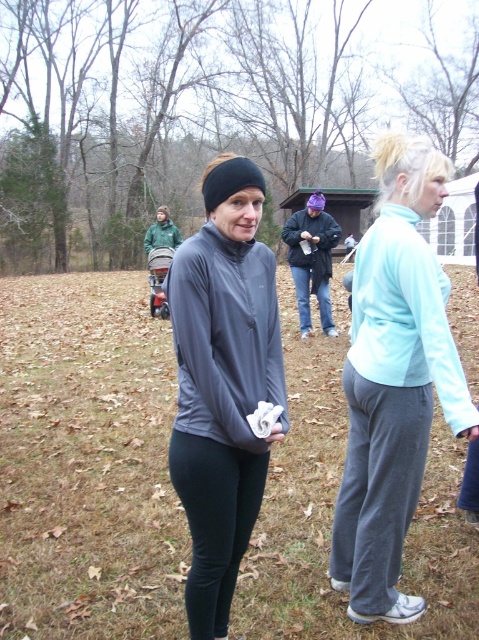
Who is positioned more to the right, light blue fleece at right or matte gray sweatshirt at center?

From the viewer's perspective, light blue fleece at right appears more on the right side.

Is point (431, 394) positioned after point (235, 422)?

Yes.

Who is more forward, (430, 248) or (203, 433)?

Positioned in front is point (203, 433).

This screenshot has height=640, width=479. I want to click on light blue fleece at right, so click(394, 380).

Is point (193, 506) positioned after point (297, 275)?

That is False.

Between point (216, 628) and point (305, 337), which one is positioned in front?

Point (216, 628)

Does point (212, 632) come farther from viewer compared to point (305, 241)?

No.

At what (x,y) coordinates should I click in order to perform the action: click on black matte leggings at center. Please return your answer as a coordinate pair (x, y). Looking at the image, I should click on (215, 522).

Can you confirm if gray sweatpants at lower right is thinner than dark blue jacket at center?

Indeed, gray sweatpants at lower right has a lesser width compared to dark blue jacket at center.

Does gray sweatpants at lower right come behind dark blue jacket at center?

No, it is in front of dark blue jacket at center.

Is point (361, 504) in front of point (296, 294)?

Yes, it is in front of point (296, 294).

The height and width of the screenshot is (640, 479). Find the location of `gray sweatpants at lower right`. gray sweatpants at lower right is located at coordinates (377, 486).